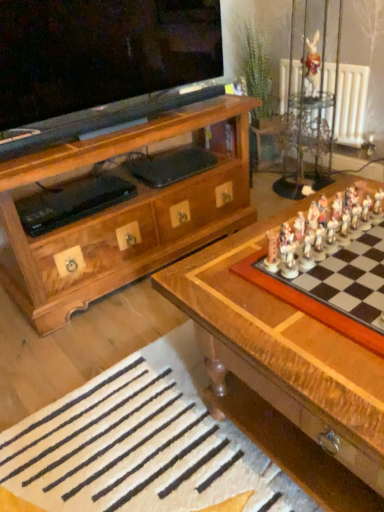
This screenshot has height=512, width=384. I want to click on vacant area that is situated to the right of clear glass vase at upper right, so click(318, 178).